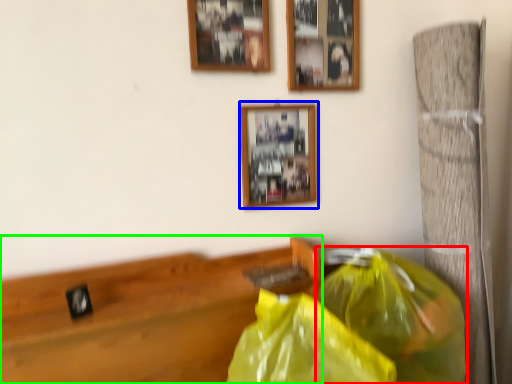
Question: Which is farther away from plastic bag (highlighted by a red box)? picture frame (highlighted by a blue box) or furniture (highlighted by a green box)?

Choices:
 (A) picture frame
 (B) furniture

Answer: (A)